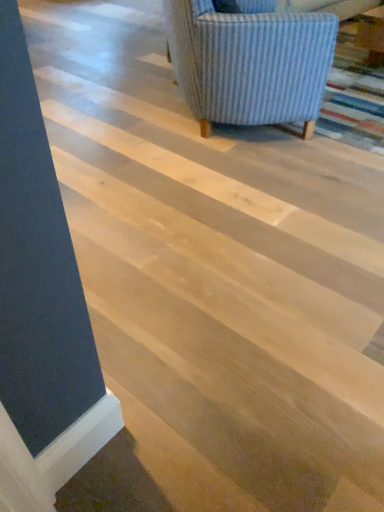
The width and height of the screenshot is (384, 512). Identify the location of free space in front of blue striped fabric chair at upper right. pyautogui.click(x=229, y=184).